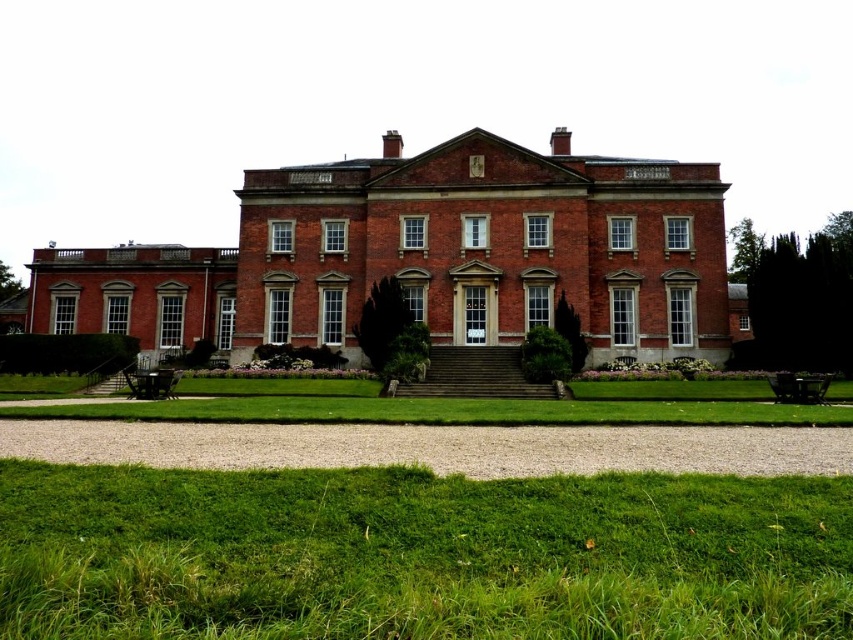
Does green grass at lower center have a lesser width compared to dark brown wooden park bench at lower right?

No, green grass at lower center is not thinner than dark brown wooden park bench at lower right.

Is point (581, 595) farther from viewer compared to point (814, 376)?

That is False.

Who is more forward, (73, 540) or (813, 397)?

Point (73, 540) is more forward.

Find the location of `green grass at lower center`. green grass at lower center is located at coordinates (419, 554).

Between brick mansion at center and dark brown wooden park bench at lower right, which one has less height?

Standing shorter between the two is dark brown wooden park bench at lower right.

Between point (485, 205) and point (805, 376), which one is positioned behind?

The point (485, 205) is more distant.

Is point (596, 355) positioned behind point (817, 381)?

Yes, point (596, 355) is farther from viewer.

Find the location of a particular element. This screenshot has width=853, height=640. brick mansion at center is located at coordinates (425, 257).

Can you confirm if brick mansion at center is thinner than wooden park bench at lower left?

No.

What are the coordinates of `brick mansion at center` in the screenshot? It's located at (425, 257).

Which is behind, point (325, 328) or point (137, 381)?

Point (325, 328)

You are a GUI agent. You are given a task and a screenshot of the screen. Output one action in this format:
    pyautogui.click(x=<x>, y=<y>)
    Task: Click on the brick mansion at center
    The width and height of the screenshot is (853, 640).
    Given the screenshot: What is the action you would take?
    pyautogui.click(x=425, y=257)